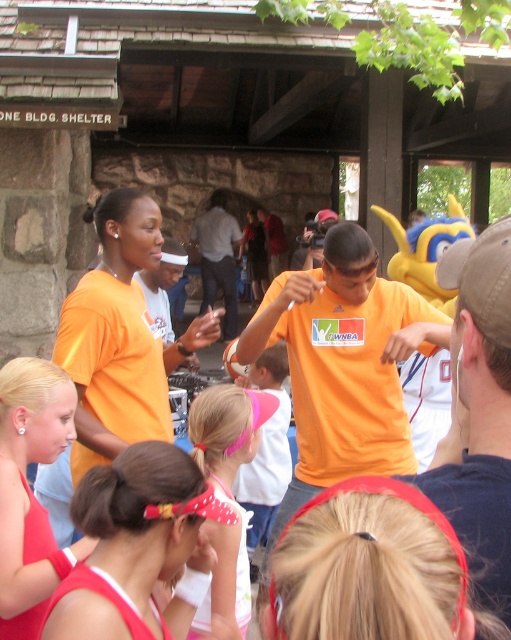
Is point (33, 454) positioned behind point (194, 412)?

No.

Which is behind, point (64, 429) or point (243, 525)?

Point (243, 525)

Find the location of a particular element. The width and height of the screenshot is (511, 640). matte red swimsuit at lower left is located at coordinates (31, 490).